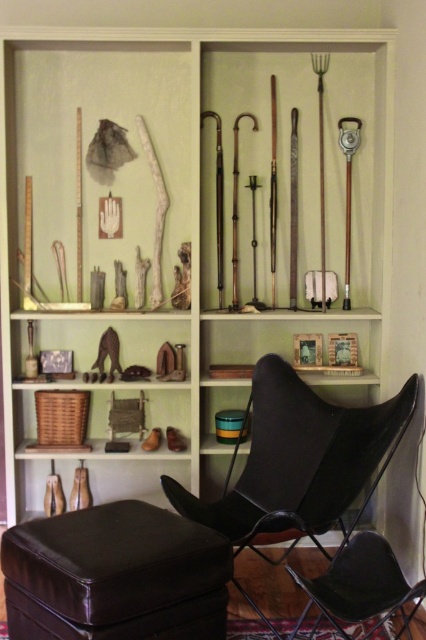
Question: Is black matte chair at center below wooden figurines at center?

Choices:
 (A) no
 (B) yes

Answer: (B)

Question: Estimate the real-world distances between objects in this image. Which object is closer to the black matte chair at center?

Choices:
 (A) wooden tools at upper center
 (B) wooden figurines at center

Answer: (A)

Question: Considering the real-world distances, which object is closest to the black matte chair at center?

Choices:
 (A) black leather chair at lower right
 (B) wooden tools at upper center
 (C) wooden figurines at center
 (D) brown leather ottoman at lower left

Answer: (A)

Question: Is brown leather ottoman at lower left closer to the viewer compared to wooden tools at upper center?

Choices:
 (A) yes
 (B) no

Answer: (A)

Question: Among these points, which one is nearest to the camera?

Choices:
 (A) pyautogui.click(x=160, y=600)
 (B) pyautogui.click(x=62, y=333)
 (C) pyautogui.click(x=273, y=426)

Answer: (A)

Question: Can you confirm if wooden tools at upper center is thinner than wooden figurines at center?

Choices:
 (A) no
 (B) yes

Answer: (A)